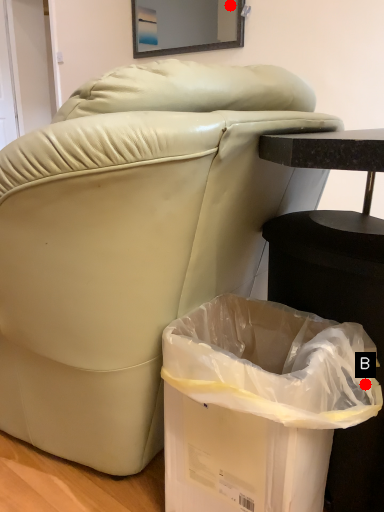
Question: Two points are circled on the image, labeled by A and B beside each circle. Which point is farther from the camera taking this photo?

Choices:
 (A) A is further
 (B) B is further

Answer: (A)